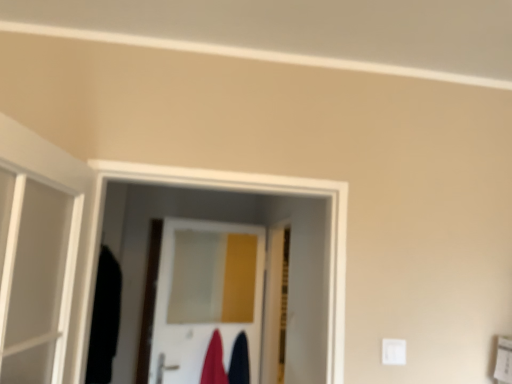
Question: Does velvet dark blue robe at center, placed as the 1th robe when sorted from right to left, have a greater height compared to wooden door at center, which ranks as the 1th door in right-to-left order?

Choices:
 (A) no
 (B) yes

Answer: (A)

Question: Can you confirm if velvet dark blue robe at center, which is counted as the 2th robe, starting from the left, is smaller than wooden door at center, which appears as the second door when viewed from the left?

Choices:
 (A) yes
 (B) no

Answer: (A)

Question: Is velvet dark blue robe at center, placed as the 1th robe when sorted from right to left, to the left of wooden door at center, which ranks as the 1th door in right-to-left order, from the viewer's perspective?

Choices:
 (A) no
 (B) yes

Answer: (B)

Question: Does velvet dark blue robe at center, placed as the 1th robe when sorted from right to left, have a greater width compared to wooden door at center, which ranks as the 1th door in right-to-left order?

Choices:
 (A) no
 (B) yes

Answer: (B)

Question: Is velvet dark blue robe at center, placed as the 1th robe when sorted from right to left, surrounding wooden door at center, which appears as the second door when viewed from the left?

Choices:
 (A) yes
 (B) no

Answer: (B)

Question: Are velvet dark blue robe at center, placed as the 1th robe when sorted from right to left, and wooden door at center, which appears as the second door when viewed from the left, making contact?

Choices:
 (A) yes
 (B) no

Answer: (B)

Question: From the image's perspective, is wooden door at center, which appears as the second door when viewed from the left, on velvet-like red robe at center, the 1th robe positioned from the left?

Choices:
 (A) no
 (B) yes

Answer: (B)

Question: Considering the relative positions of wooden door at center, which ranks as the 1th door in right-to-left order, and velvet-like red robe at center, the 1th robe positioned from the left, in the image provided, is wooden door at center, which ranks as the 1th door in right-to-left order, to the right of velvet-like red robe at center, the 1th robe positioned from the left, from the viewer's perspective?

Choices:
 (A) no
 (B) yes

Answer: (B)

Question: Is wooden door at center, which appears as the second door when viewed from the left, behind velvet-like red robe at center, acting as the 2th robe starting from the right?

Choices:
 (A) yes
 (B) no

Answer: (B)

Question: Considering the relative sizes of wooden door at center, which ranks as the 1th door in right-to-left order, and velvet-like red robe at center, the 1th robe positioned from the left, in the image provided, is wooden door at center, which ranks as the 1th door in right-to-left order, smaller than velvet-like red robe at center, the 1th robe positioned from the left,?

Choices:
 (A) no
 (B) yes

Answer: (A)

Question: Can you confirm if wooden door at center, which appears as the second door when viewed from the left, is wider than velvet-like red robe at center, acting as the 2th robe starting from the right?

Choices:
 (A) no
 (B) yes

Answer: (A)

Question: Are wooden door at center, which appears as the second door when viewed from the left, and velvet-like red robe at center, the 1th robe positioned from the left, far apart?

Choices:
 (A) no
 (B) yes

Answer: (A)

Question: Does white glossy door at center, the first door in the left-to-right sequence, come behind velvet-like red robe at center, acting as the 2th robe starting from the right?

Choices:
 (A) no
 (B) yes

Answer: (A)